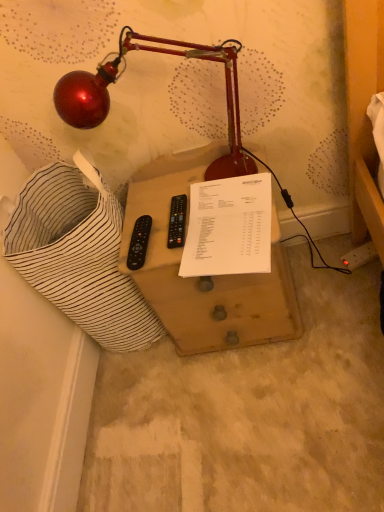
You are a GUI agent. You are given a task and a screenshot of the screen. Output one action in this format:
    pyautogui.click(x=<x>, y=<y>)
    Task: Click on the free spot behind black plastic remote at center-left, arranged as the second control when viewed from the right
    The width and height of the screenshot is (384, 512).
    Given the screenshot: What is the action you would take?
    pyautogui.click(x=146, y=201)